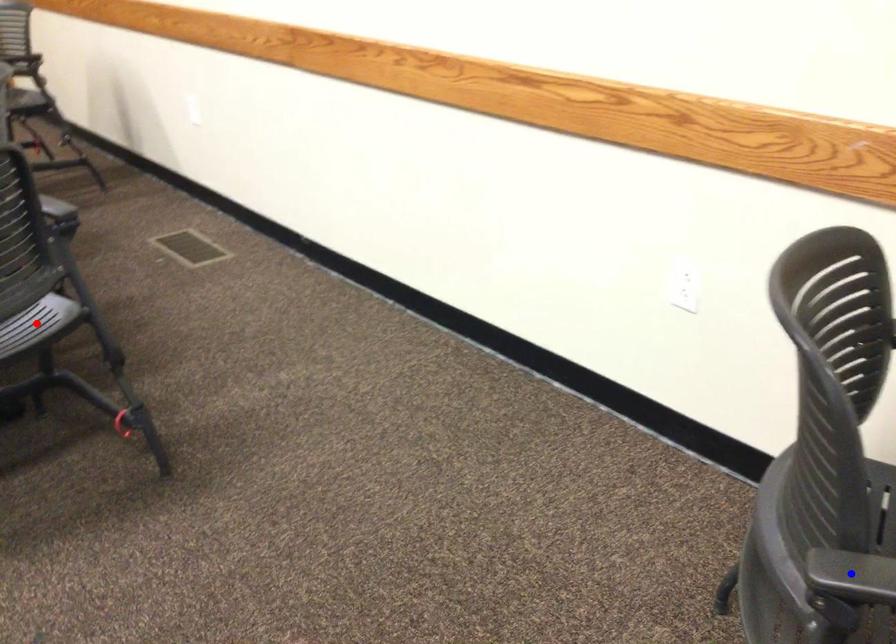
Question: In the image, two points are highlighted. Which point is nearer to the camera? Reply with the corresponding letter.

Choices:
 (A) blue point
 (B) red point

Answer: (A)